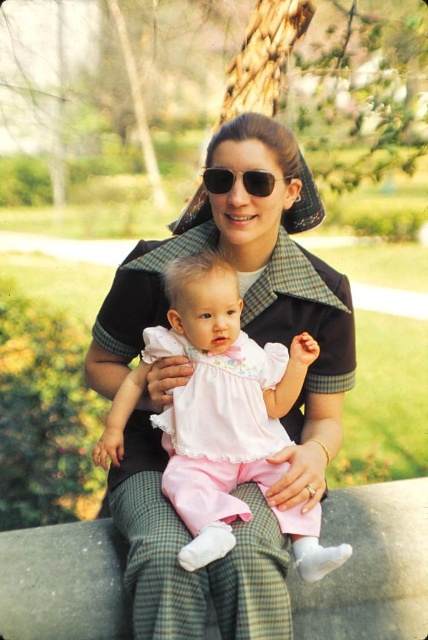
You are a photographer who wants to capture a closeup of the pink satin dress at center and the black matte sunglasses at center. Since the camera can only focus on one object at a time, which object should you choose to ensure the other fits within the frame?

The pink satin dress at center is larger in size than the black matte sunglasses at center, so you should focus on the pink satin dress at center to ensure the smaller black matte sunglasses at center fits within the frame.